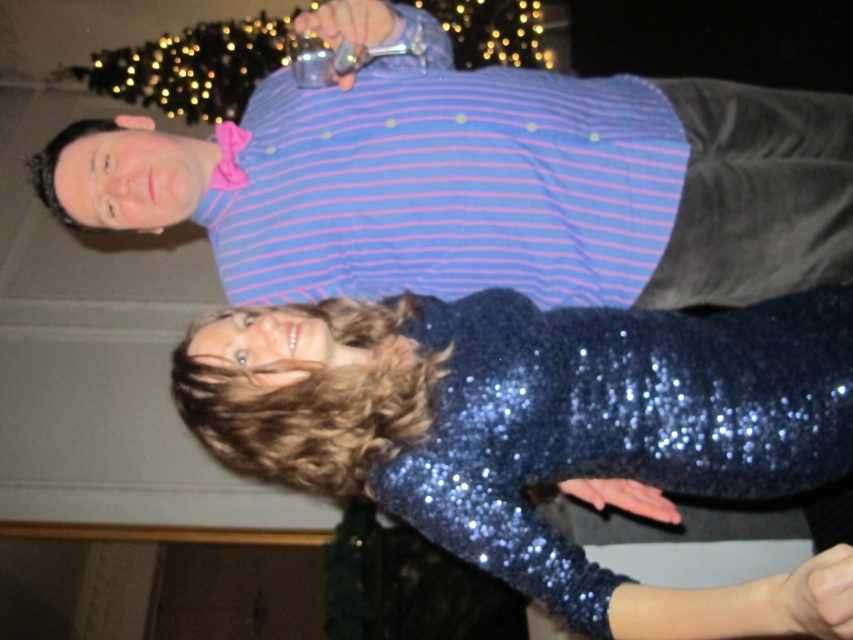
Is blue striped shirt at upper center positioned in front of sparkly blue dress at center?

That is False.

Does blue striped shirt at upper center appear over sparkly blue dress at center?

Yes, blue striped shirt at upper center is above sparkly blue dress at center.

Who is more distant from viewer, (721, 176) or (271, 474)?

The point (721, 176) is more distant.

What are the coordinates of `blue striped shirt at upper center` in the screenshot? It's located at (485, 182).